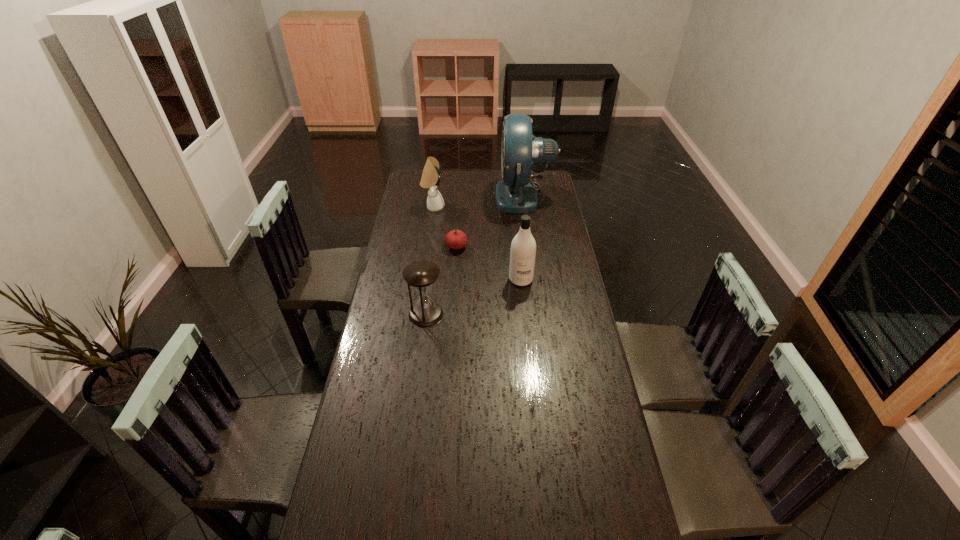
Where is `vacant space at the left edge of the desktop`? The width and height of the screenshot is (960, 540). vacant space at the left edge of the desktop is located at coordinates (397, 450).

Locate an element on the screen. The height and width of the screenshot is (540, 960). vacant space at the right edge of the desktop is located at coordinates (549, 350).

Identify the location of vacant space at the far right corner of the desktop. (536, 180).

The height and width of the screenshot is (540, 960). I want to click on free space that is in between the doll and the shampoo, so click(477, 243).

This screenshot has height=540, width=960. Identify the location of free space between the doll and the third nearest object. (444, 227).

In order to click on free area in between the doll and the tomato in this screenshot , I will do `click(444, 227)`.

Find the location of `free spot between the nearest object and the fan`. free spot between the nearest object and the fan is located at coordinates (475, 255).

This screenshot has width=960, height=540. I want to click on object that stands as the fourth closest to the fan, so click(421, 275).

Where is `object identified as the third closest to the third nearest object`? object identified as the third closest to the third nearest object is located at coordinates (516, 193).

The width and height of the screenshot is (960, 540). What are the coordinates of `vacant space that satisfies the following two spatial constraints: 1. at the front face of the doll; 2. on the left side of the hourglass` in the screenshot? It's located at (419, 314).